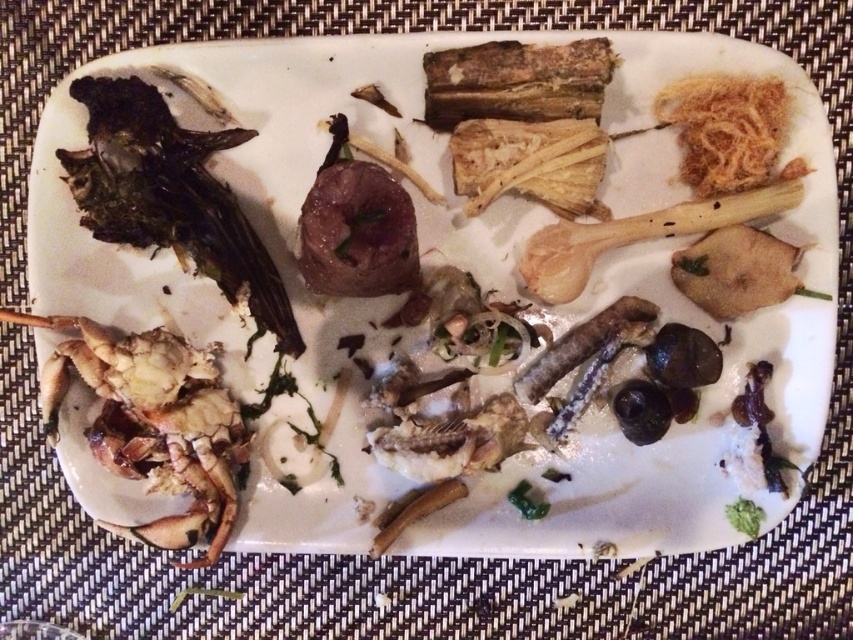
Question: Does charcoal black seaweed at left appear under golden crispy noodles at upper right?

Choices:
 (A) yes
 (B) no

Answer: (A)

Question: From the image, what is the correct spatial relationship of charcoal black seaweed at left in relation to golden crispy noodles at upper right?

Choices:
 (A) left
 (B) right

Answer: (A)

Question: Among these objects, which one is farthest from the camera?

Choices:
 (A) golden crispy noodles at upper right
 (B) charcoal black seaweed at left

Answer: (B)

Question: Does charcoal black seaweed at left have a larger size compared to golden crispy noodles at upper right?

Choices:
 (A) no
 (B) yes

Answer: (B)

Question: Which object appears closest to the camera in this image?

Choices:
 (A) charcoal black seaweed at left
 (B) golden crispy noodles at upper right

Answer: (B)